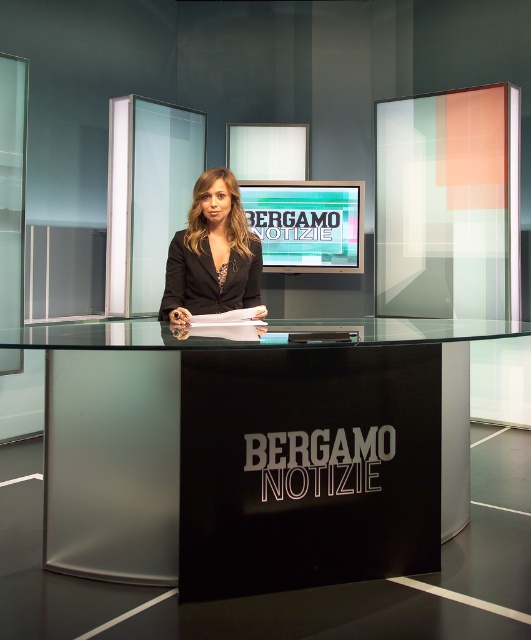
Question: Does transparent glass table at center have a smaller size compared to matte black blazer at center?

Choices:
 (A) yes
 (B) no

Answer: (B)

Question: Is transparent glass table at center thinner than matte black blazer at center?

Choices:
 (A) no
 (B) yes

Answer: (A)

Question: Which of the following is the closest to the observer?

Choices:
 (A) transparent glass table at center
 (B) matte black blazer at center

Answer: (A)

Question: Is transparent glass table at center to the right of matte black blazer at center from the viewer's perspective?

Choices:
 (A) yes
 (B) no

Answer: (A)

Question: Among these points, which one is farthest from the camera?

Choices:
 (A) (89, 353)
 (B) (226, 209)

Answer: (B)